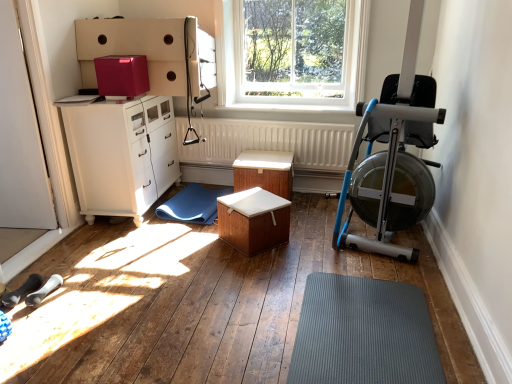
Where is `free space to the left of gray rubber mat at lower center, the 2th doormat from the left`? The width and height of the screenshot is (512, 384). free space to the left of gray rubber mat at lower center, the 2th doormat from the left is located at coordinates (229, 323).